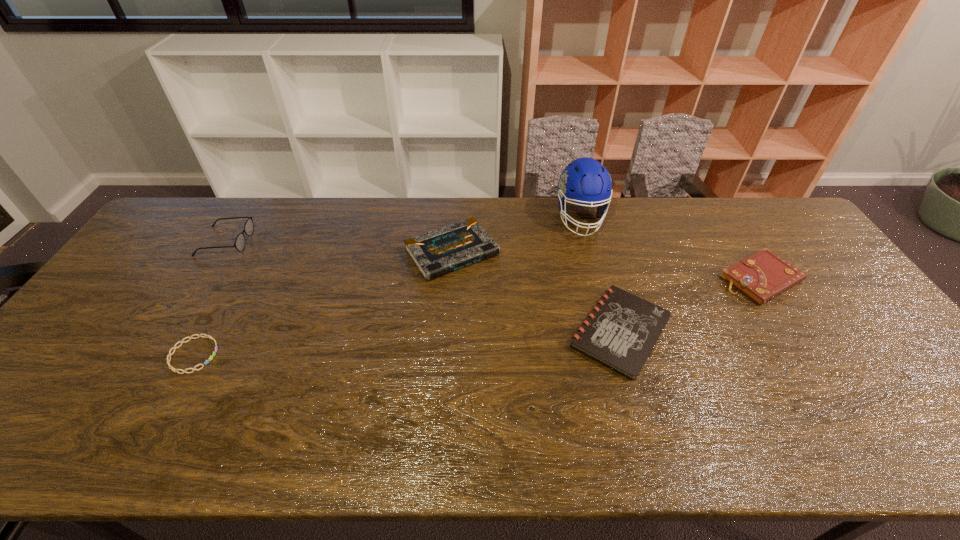
This screenshot has height=540, width=960. What are the coordinates of `vacant space that satisfies the following two spatial constraints: 1. on the face guard of the tallest object; 2. on the left side of the rightmost object` in the screenshot? It's located at click(x=596, y=279).

At what (x,y) coordinates should I click in order to perform the action: click on vacant space that satisfies the following two spatial constraints: 1. on the face guard of the tallest object; 2. on the surface of the bracelet showing star-shaped elements. Please return your answer as a coordinate pair (x, y). The image size is (960, 540). Looking at the image, I should click on (616, 355).